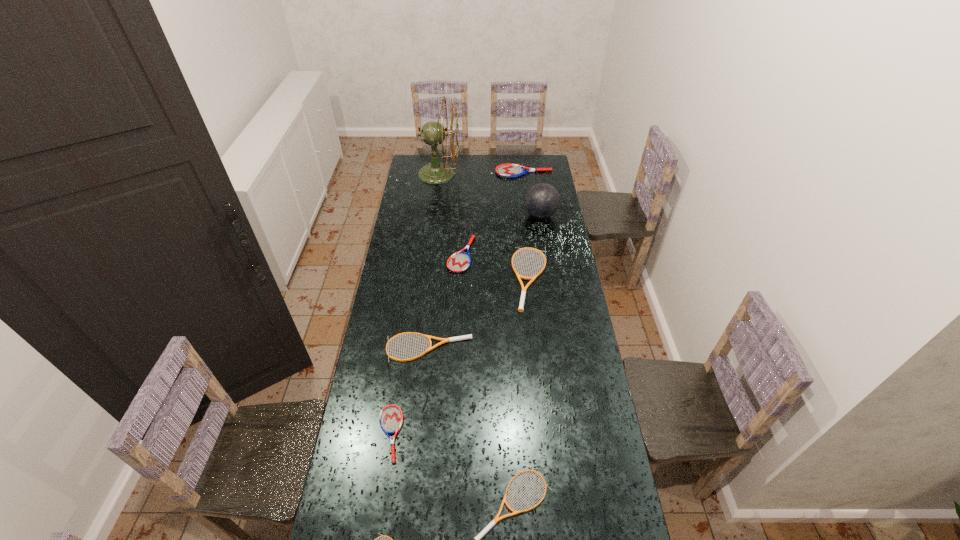
Locate an element on the screen. The image size is (960, 540). free space between the fan and the second blue tennis racket from left to right is located at coordinates (450, 214).

I want to click on unoccupied area between the third farthest object and the fourth nearest object, so (485, 282).

What are the coordinates of `vacant area between the biggest blue tennis racket and the biggest beige tennis racket` in the screenshot? It's located at (528, 225).

I want to click on free space between the farthest beige tennis racket and the second farthest blue tennis racket, so click(496, 267).

In order to click on vacant area that lies between the fan and the farthest tennis racket in this screenshot , I will do `click(481, 173)`.

In order to click on vacant space that is in between the eighth shortest object and the farthest beige tennis racket in this screenshot , I will do `click(536, 247)`.

Locate an element on the screen. The height and width of the screenshot is (540, 960). object that stands as the seventh closest to the smallest beige tennis racket is located at coordinates (433, 133).

Select which object is the fourth closest to the tallest object. Please provide its 2D coordinates. Your answer should be formatted as a tuple, i.e. [(x, y)], where the tuple contains the x and y coordinates of a point satisfying the conditions above.

[(523, 292)]

Select which tennis racket is the closest to the farthest beige tennis racket. Please provide its 2D coordinates. Your answer should be formatted as a tuple, i.e. [(x, y)], where the tuple contains the x and y coordinates of a point satisfying the conditions above.

[(460, 261)]

Identify which tennis racket is the second nearest to the fan. Please provide its 2D coordinates. Your answer should be formatted as a tuple, i.e. [(x, y)], where the tuple contains the x and y coordinates of a point satisfying the conditions above.

[(460, 261)]